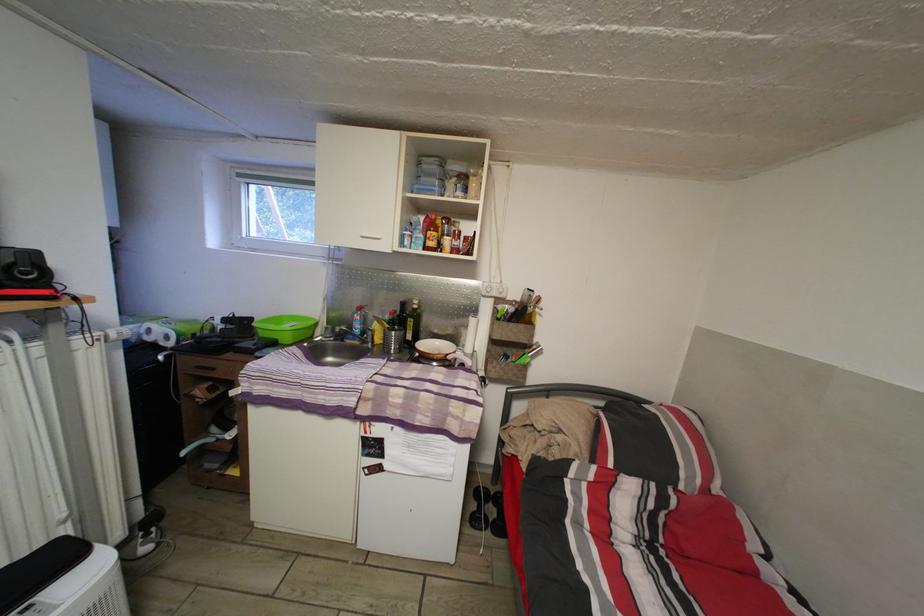
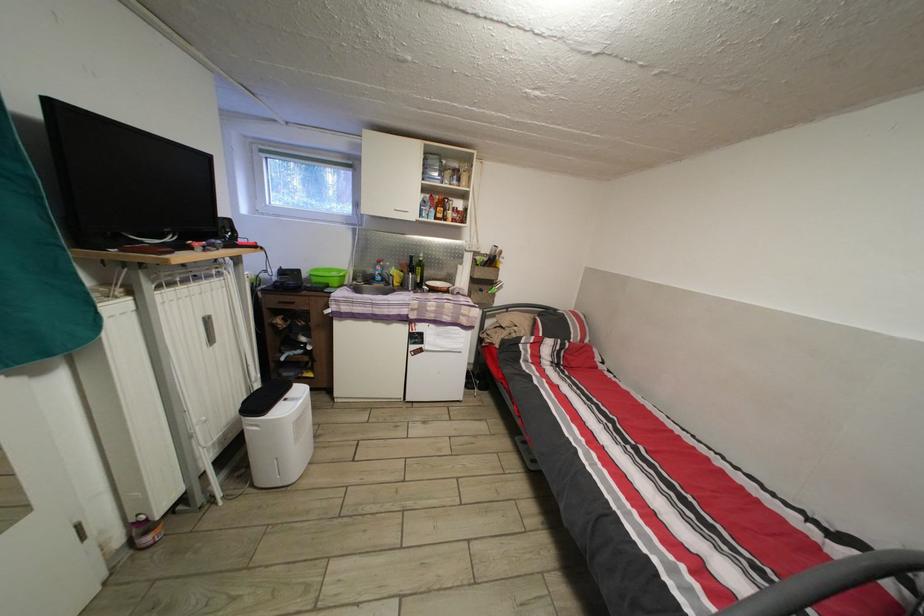
Question: The camera is either moving clockwise (left) or counter-clockwise (right) around the object. The first image is from the beginning of the video and the second image is from the end. Is the camera moving left or right when shooting the video?

Choices:
 (A) Left
 (B) Right

Answer: (A)